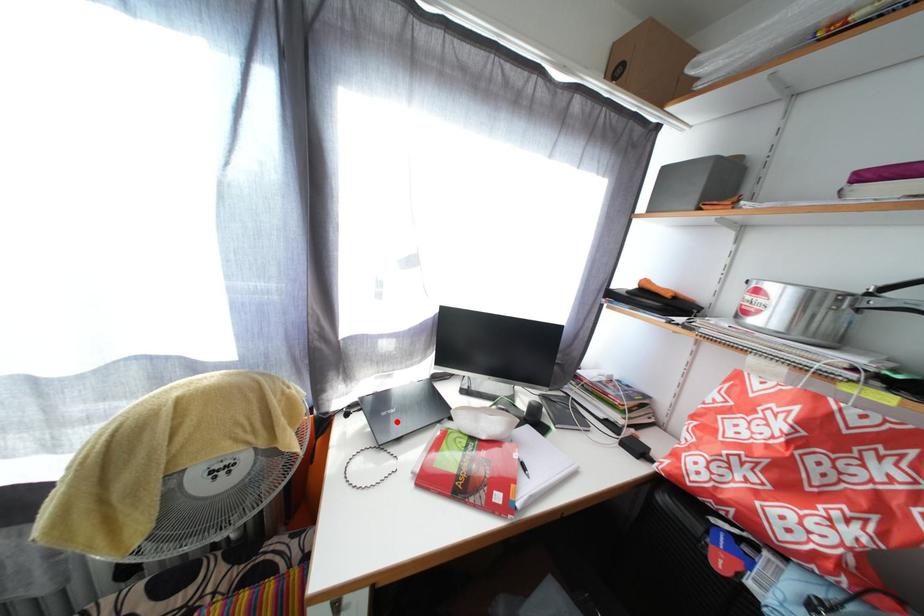
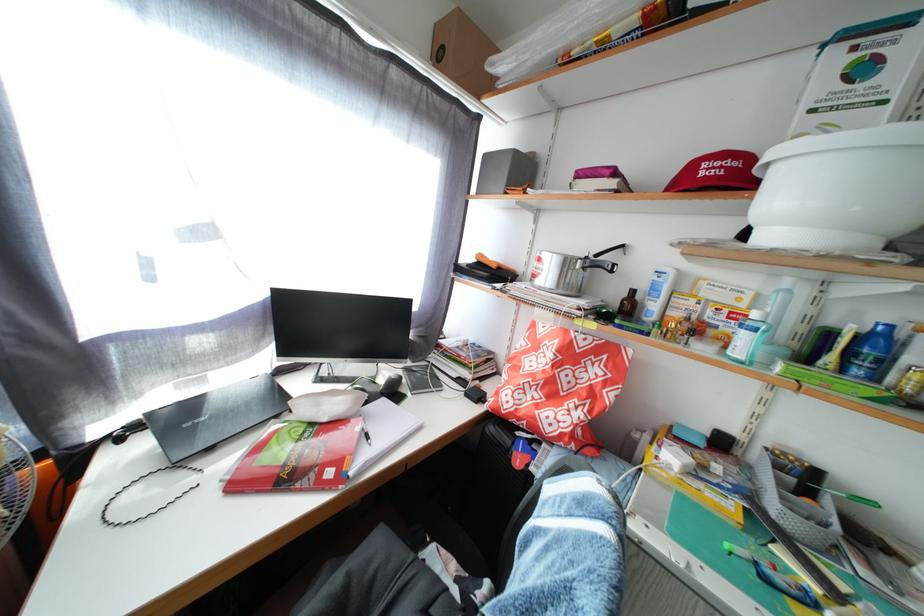
Find the pixel in the second image that matches the highlighted location in the first image.

(204, 432)